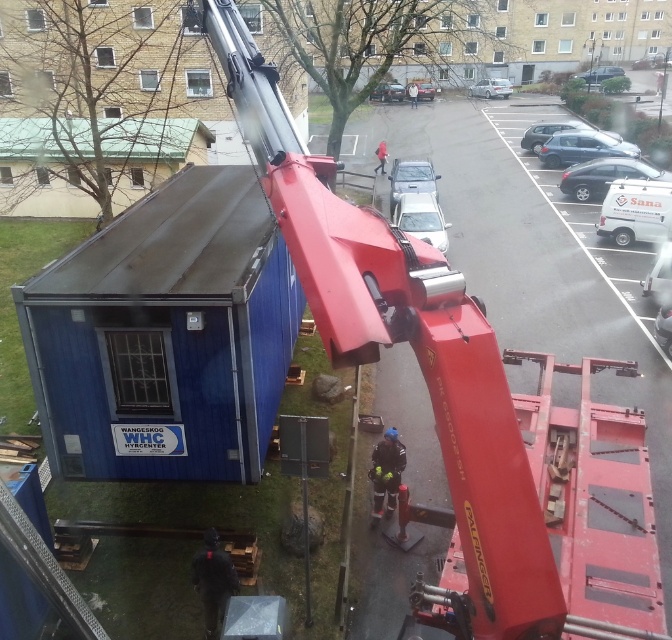
You are a safety inspector checking the workspace. You notice the metallic red crane arm at center and the silver metallic sedan at upper center. Which object is wider?

The silver metallic sedan at upper center is wider than the metallic red crane arm at center.

You are a delivery driver who needs to park your truck next to the metallic blue sedan at upper right. According to the coordinates provided, where exactly should you position your truck relative to the sedan?

The metallic blue sedan at upper right is located at point coordinates (583, 147). You should position your truck near those coordinates to park next to it.